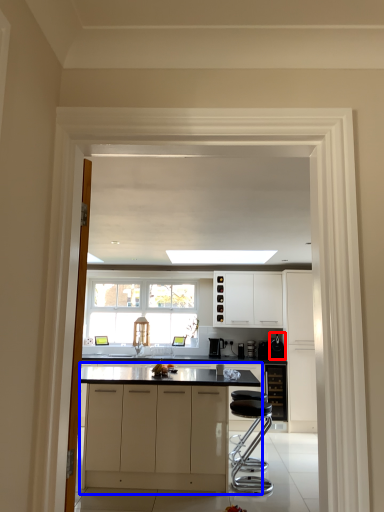
Question: Among these objects, which one is farthest to the camera, appliance (highlighted by a red box) or cabinetry (highlighted by a blue box)?

Choices:
 (A) appliance
 (B) cabinetry

Answer: (A)